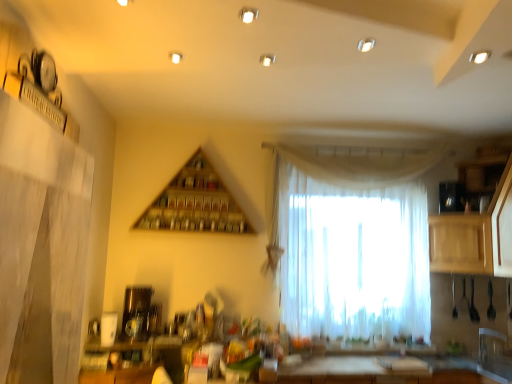
Find the location of `free location above white sheer curtain at center (from a real-world perspective)`. free location above white sheer curtain at center (from a real-world perspective) is located at coordinates (355, 150).